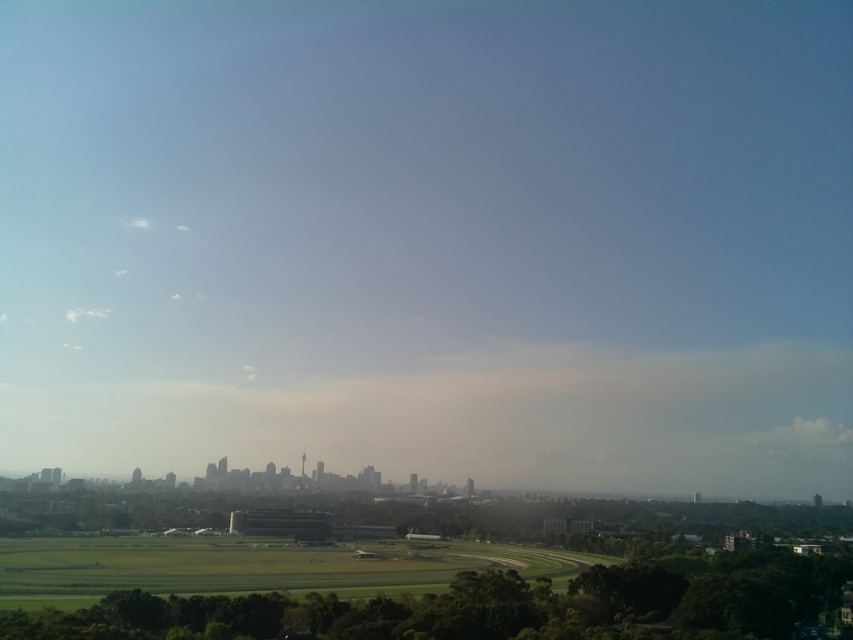
You are standing in the cityscape scene and want to walk from the point at coordinates point (122, 563) to the point at coordinates point (80, 312). Which direction should you face to move towards the second point?

Since point (122, 563) is closer to the viewer than point (80, 312), you should face towards the background of the image to move towards the second point.

You are a drone operator planning to fly a drone over the cityscape. The green grass at center and the white fluffy cloud at upper left are visible. Which object is wider from the drone operator perspective?

The green grass at center might be wider than the white fluffy cloud at upper left.